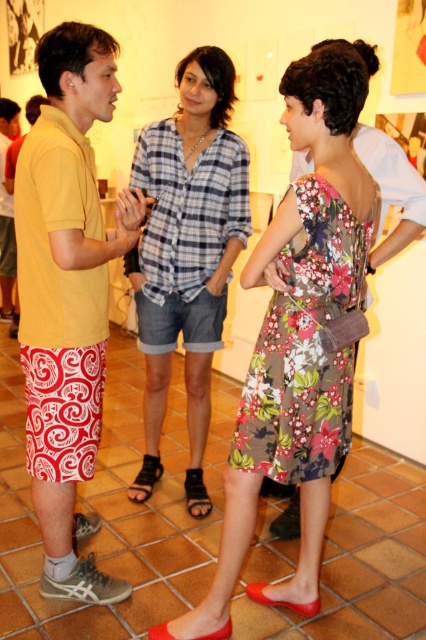
You are trying to get a clear photo of the yellow cotton shirt at left without the floral fabric dress at center blocking it. What should you do?

Move to the side so that the yellow cotton shirt at left is no longer behind the floral fabric dress at center.

You are standing in the gallery and want to take a photo of the plaid cotton shirt at center. Which direction should you move to get a better angle?

The plaid cotton shirt at center is located at point (187, 252), so you should move to the left or right to get a better angle depending on your current position.

You are organizing a clothing display and need to place the floral fabric dress at center and the yellow cotton shirt at left. Which item requires more space due to its size?

The floral fabric dress at center requires more space because it has a larger size compared to the yellow cotton shirt at left.